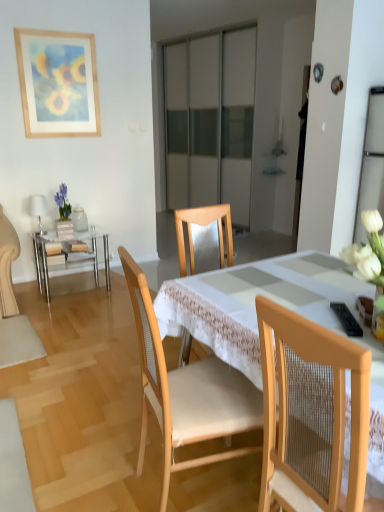
Question: From a real-world perspective, is matte glass vase at left above or below wooden picture frame at upper left?

Choices:
 (A) above
 (B) below

Answer: (B)

Question: In terms of size, does matte glass vase at left appear bigger or smaller than wooden picture frame at upper left?

Choices:
 (A) small
 (B) big

Answer: (A)

Question: Based on their relative distances, which object is farther from the clear glass table at left?

Choices:
 (A) black plastic remote control at lower right
 (B) wooden mesh chair at center, which appears as the first chair when viewed from the right
 (C) matte glass vase at left
 (D) wooden picture frame at upper left
 (E) wooden chair at center, marked as the second chair in a right-to-left arrangement

Answer: (B)

Question: Estimate the real-world distances between objects in this image. Which object is farther from the wooden table at center?

Choices:
 (A) wooden mesh chair at center, which appears as the first chair when viewed from the right
 (B) wooden picture frame at upper left
 (C) wooden chair at center, marked as the second chair in a right-to-left arrangement
 (D) clear glass table at left
 (E) matte glass vase at left

Answer: (B)